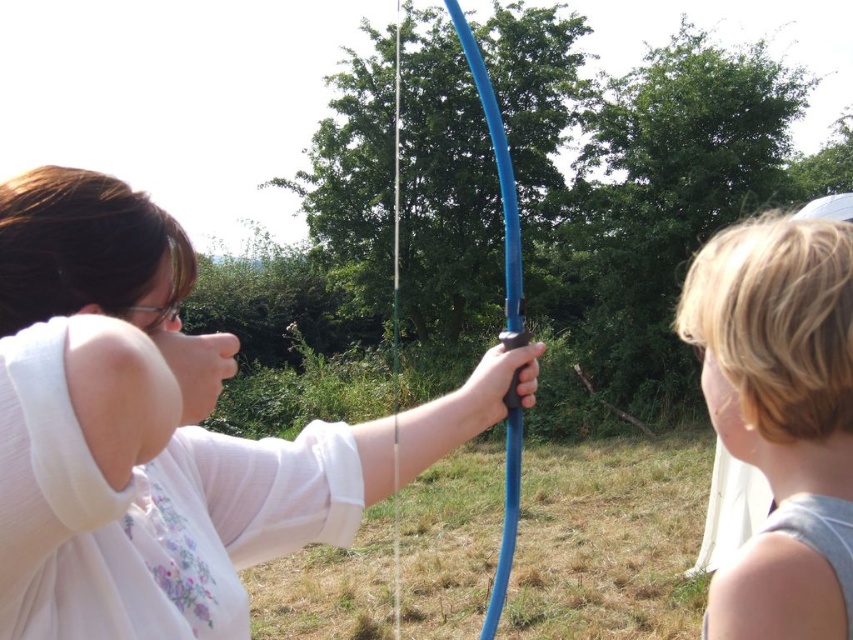
You are a photographer setting up for an archery event. You have a matte white shirt at center and a blue rubber hose at center in your frame. Which object is narrower in width?

The matte white shirt at center is narrower in width than the blue rubber hose at center.

You are a photographer trying to capture a closeup of the matte white shirt at center and the blonde hair at right. Based on their positions, which one should you focus on first to ensure both are in the frame?

The matte white shirt at center is positioned under blonde hair at right, so you should focus on the blonde hair at right first to ensure both are in the frame.

You are a photographer standing at the origin point of the coordinate system. You want to take a picture of the matte white shirt at center. What are the coordinates where you should aim your camera?

The coordinates to aim the camera are at point (149, 406).